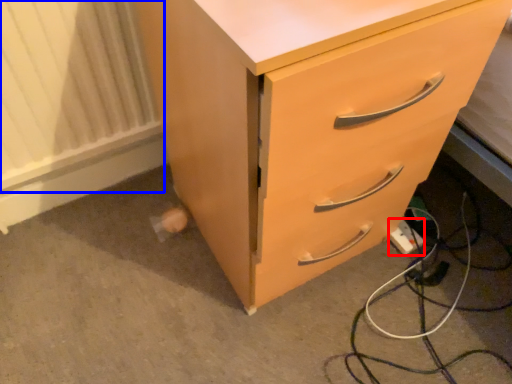
Question: Which object appears farthest to the camera in this image, extension cord (highlighted by a red box) or radiator (highlighted by a blue box)?

Choices:
 (A) extension cord
 (B) radiator

Answer: (A)